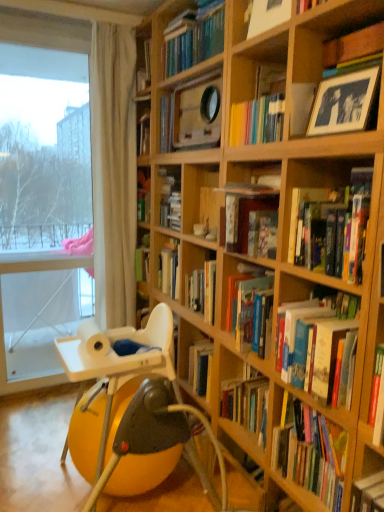
Question: Considering the relative sizes of hardcover book at center, arranged as the 5th book when viewed from the top, and hardcover book at center, acting as the 4th book starting from the top, in the image provided, is hardcover book at center, arranged as the 5th book when viewed from the top, wider than hardcover book at center, acting as the 4th book starting from the top,?

Choices:
 (A) no
 (B) yes

Answer: (B)

Question: Is hardcover book at center, which ranks as the second book in bottom-to-top order, bigger than hardcover book at center, acting as the 4th book starting from the top?

Choices:
 (A) no
 (B) yes

Answer: (B)

Question: Does hardcover book at center, which ranks as the second book in bottom-to-top order, have a lesser height compared to hardcover book at center, the third book positioned from the bottom?

Choices:
 (A) no
 (B) yes

Answer: (B)

Question: From the image's perspective, is hardcover book at center, which ranks as the second book in bottom-to-top order, under hardcover book at center, the third book positioned from the bottom?

Choices:
 (A) yes
 (B) no

Answer: (A)

Question: Does hardcover book at center, arranged as the 5th book when viewed from the top, come in front of hardcover book at center, the third book positioned from the bottom?

Choices:
 (A) yes
 (B) no

Answer: (A)

Question: Would you say wooden framed picture at upper right is to the left or to the right of blue-toned matte photo frame at upper right in the picture?

Choices:
 (A) left
 (B) right

Answer: (B)

Question: From a real-world perspective, is wooden framed picture at upper right positioned above or below blue-toned matte photo frame at upper right?

Choices:
 (A) below
 (B) above

Answer: (B)

Question: In terms of height, does wooden framed picture at upper right look taller or shorter compared to blue-toned matte photo frame at upper right?

Choices:
 (A) short
 (B) tall

Answer: (B)

Question: From the image's perspective, is wooden framed picture at upper right above or below blue-toned matte photo frame at upper right?

Choices:
 (A) above
 (B) below

Answer: (A)

Question: From a real-world perspective, is white sheer curtain at left positioned above or below wooden frame at upper center, the second book positioned from the top?

Choices:
 (A) above
 (B) below

Answer: (B)

Question: Is white sheer curtain at left to the left or to the right of wooden frame at upper center, the second book positioned from the top, in the image?

Choices:
 (A) left
 (B) right

Answer: (A)

Question: In terms of size, does white sheer curtain at left appear bigger or smaller than wooden frame at upper center, marked as the 5th book in a bottom-to-top arrangement?

Choices:
 (A) big
 (B) small

Answer: (A)

Question: Is white sheer curtain at left situated inside wooden frame at upper center, the second book positioned from the top, or outside?

Choices:
 (A) inside
 (B) outside

Answer: (B)

Question: From a real-world perspective, is white plastic chair at lower left above or below blue-toned matte photo frame at upper right?

Choices:
 (A) above
 (B) below

Answer: (B)

Question: Is white plastic chair at lower left inside or outside of blue-toned matte photo frame at upper right?

Choices:
 (A) inside
 (B) outside

Answer: (B)